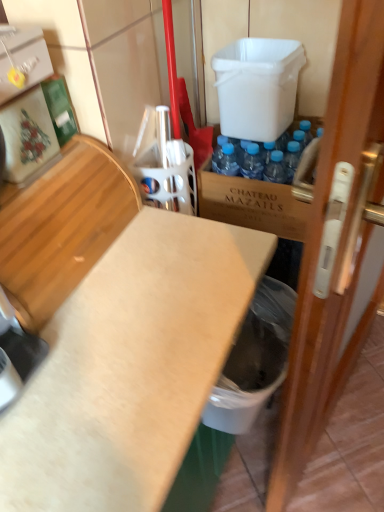
Where is `empty space that is ontop of white matte countertop at center`? The height and width of the screenshot is (512, 384). empty space that is ontop of white matte countertop at center is located at coordinates (117, 312).